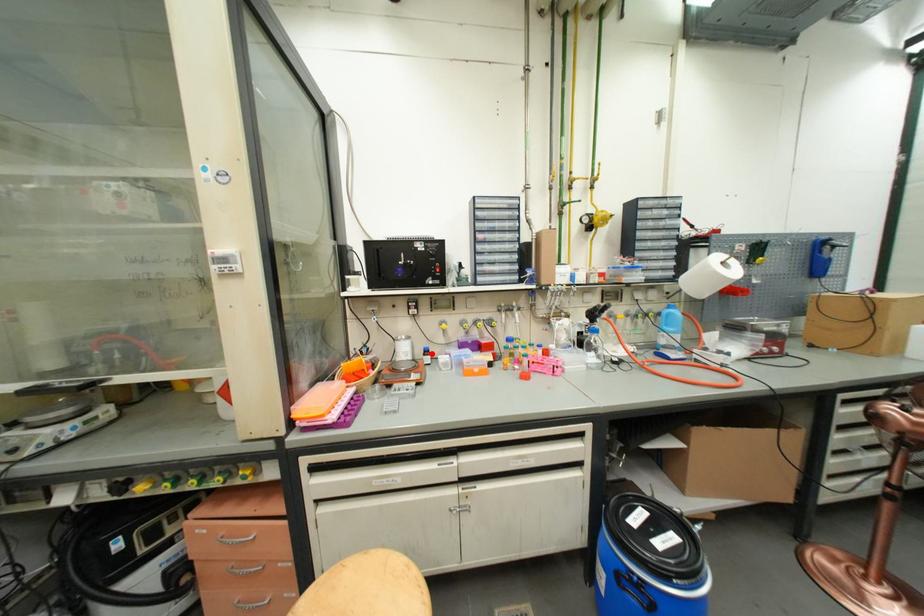
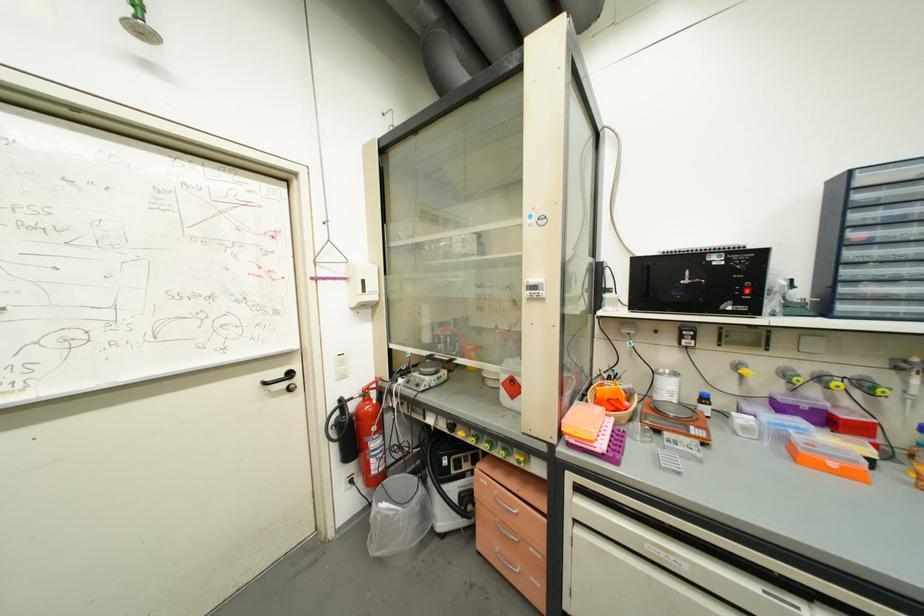
Locate, in the second image, the point that corresponds to the highlighted location in the first image.

(710, 400)